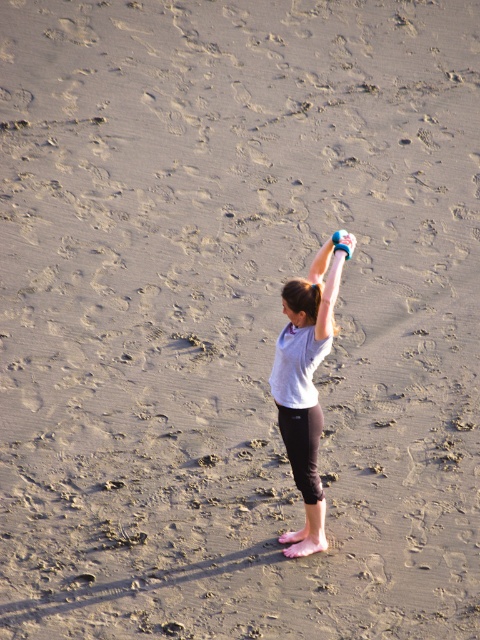
You are a fashion designer observing the image of a person on a beach. You need to determine the placement of a new accessory between the gray fabric shirt at center and the blue rubber band at upper center. Which object should the accessory be placed above to ensure it is positioned higher?

The accessory should be placed above the gray fabric shirt at center because it is taller than the blue rubber band at upper center.

You are a fitness instructor observing a person on a beach holding two items. The person is holding a smooth blue dumbbell at upper right and a blue rubber glove at upper center. Which item is bigger?

The smooth blue dumbbell at upper right is larger in size compared to the blue rubber glove at upper center.